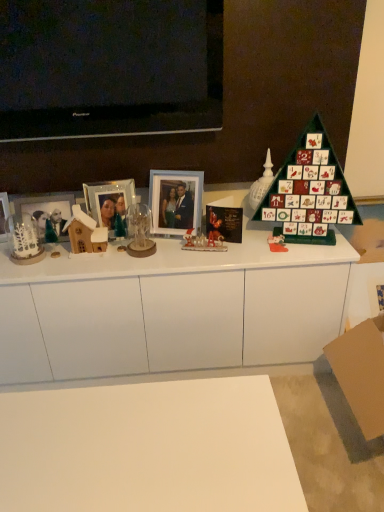
Where is `free space that is to the left of matte plastic advent calendar at right, acting as the 6th toy starting from the left`? free space that is to the left of matte plastic advent calendar at right, acting as the 6th toy starting from the left is located at coordinates (244, 250).